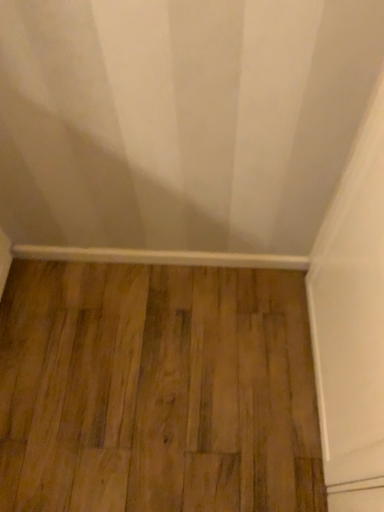
This screenshot has width=384, height=512. What do you see at coordinates (156, 390) in the screenshot?
I see `brown wood flooring at center` at bounding box center [156, 390].

Identify the location of brown wood flooring at center. This screenshot has width=384, height=512. (156, 390).

Image resolution: width=384 pixels, height=512 pixels. Describe the element at coordinates (161, 257) in the screenshot. I see `white smooth baseboard at bottom` at that location.

At what (x,y) coordinates should I click in order to perform the action: click on white smooth baseboard at bottom. Please return your answer as a coordinate pair (x, y). Looking at the image, I should click on (161, 257).

Where is `brown wood flooring at center`? The image size is (384, 512). brown wood flooring at center is located at coordinates (156, 390).

Which is more to the left, white smooth baseboard at bottom or brown wood flooring at center?

From the viewer's perspective, white smooth baseboard at bottom appears more on the left side.

Which is in front, white smooth baseboard at bottom or brown wood flooring at center?

brown wood flooring at center is closer to the camera.

Which is in front, point (101, 261) or point (107, 424)?

The point (107, 424) is more forward.

Looking at this image, from the image's perspective, is white smooth baseboard at bottom below brown wood flooring at center?

Actually, white smooth baseboard at bottom appears above brown wood flooring at center in the image.

From a real-world perspective, which is physically below, white smooth baseboard at bottom or brown wood flooring at center?

brown wood flooring at center is physically lower.

Based on the photo, which object is thinner, white smooth baseboard at bottom or brown wood flooring at center?

white smooth baseboard at bottom is thinner.

Is white smooth baseboard at bottom taller than brown wood flooring at center?

Yes.

Who is bigger, white smooth baseboard at bottom or brown wood flooring at center?

With larger size is brown wood flooring at center.

Can we say white smooth baseboard at bottom lies outside brown wood flooring at center?

Yes, white smooth baseboard at bottom is located beyond the bounds of brown wood flooring at center.

Is white smooth baseboard at bottom directly adjacent to brown wood flooring at center?

No, white smooth baseboard at bottom is not making contact with brown wood flooring at center.

Is white smooth baseboard at bottom oriented towards brown wood flooring at center?

Yes, white smooth baseboard at bottom is aimed at brown wood flooring at center.

What's the angular difference between white smooth baseboard at bottom and brown wood flooring at center's facing directions?

There is a 1.54-degree angle between the facing directions of white smooth baseboard at bottom and brown wood flooring at center.

How distant is white smooth baseboard at bottom from brown wood flooring at center?

white smooth baseboard at bottom and brown wood flooring at center are 13.54 inches apart from each other.

Where is `molding on the left of the brown wood flooring at center`? molding on the left of the brown wood flooring at center is located at coordinates (161, 257).

Between brown wood flooring at center and white smooth baseboard at bottom, which one appears on the right side from the viewer's perspective?

Positioned to the right is brown wood flooring at center.

Does brown wood flooring at center come behind white smooth baseboard at bottom?

No, brown wood flooring at center is closer to the viewer.

Is point (159, 377) less distant than point (55, 254)?

That is True.

Based on the photo, from the image's perspective, which is below, brown wood flooring at center or white smooth baseboard at bottom?

brown wood flooring at center, from the image's perspective.

In the scene shown: From a real-world perspective, is brown wood flooring at center positioned above or below white smooth baseboard at bottom?

brown wood flooring at center is below white smooth baseboard at bottom.

Considering the sizes of brown wood flooring at center and white smooth baseboard at bottom in the image, is brown wood flooring at center wider or thinner than white smooth baseboard at bottom?

Considering their sizes, brown wood flooring at center looks broader than white smooth baseboard at bottom.

Does brown wood flooring at center have a lesser height compared to white smooth baseboard at bottom?

Correct, brown wood flooring at center is not as tall as white smooth baseboard at bottom.

Considering the sizes of objects brown wood flooring at center and white smooth baseboard at bottom in the image provided, who is smaller, brown wood flooring at center or white smooth baseboard at bottom?

With smaller size is white smooth baseboard at bottom.

Can we say brown wood flooring at center lies outside white smooth baseboard at bottom?

brown wood flooring at center lies outside white smooth baseboard at bottom's area.

Does brown wood flooring at center touch white smooth baseboard at bottom?

No, brown wood flooring at center is not making contact with white smooth baseboard at bottom.

Is brown wood flooring at center oriented towards white smooth baseboard at bottom?

No.

What's the angular difference between brown wood flooring at center and white smooth baseboard at bottom's facing directions?

1.54 degrees separate the facing orientations of brown wood flooring at center and white smooth baseboard at bottom.

Based on the photo, measure the distance between brown wood flooring at center and white smooth baseboard at bottom.

brown wood flooring at center is 13.54 inches from white smooth baseboard at bottom.

At what (x,y) coordinates should I click in order to perform the action: click on hardwood on the right of white smooth baseboard at bottom. Please return your answer as a coordinate pair (x, y). The image size is (384, 512). Looking at the image, I should click on (156, 390).

At what (x,y) coordinates should I click in order to perform the action: click on molding behind the brown wood flooring at center. Please return your answer as a coordinate pair (x, y). The width and height of the screenshot is (384, 512). Looking at the image, I should click on (161, 257).

In the image, there is a white smooth baseboard at bottom. At what (x,y) coordinates should I click in order to perform the action: click on hardwood below it (from a real-world perspective). Please return your answer as a coordinate pair (x, y). The width and height of the screenshot is (384, 512). Looking at the image, I should click on (156, 390).